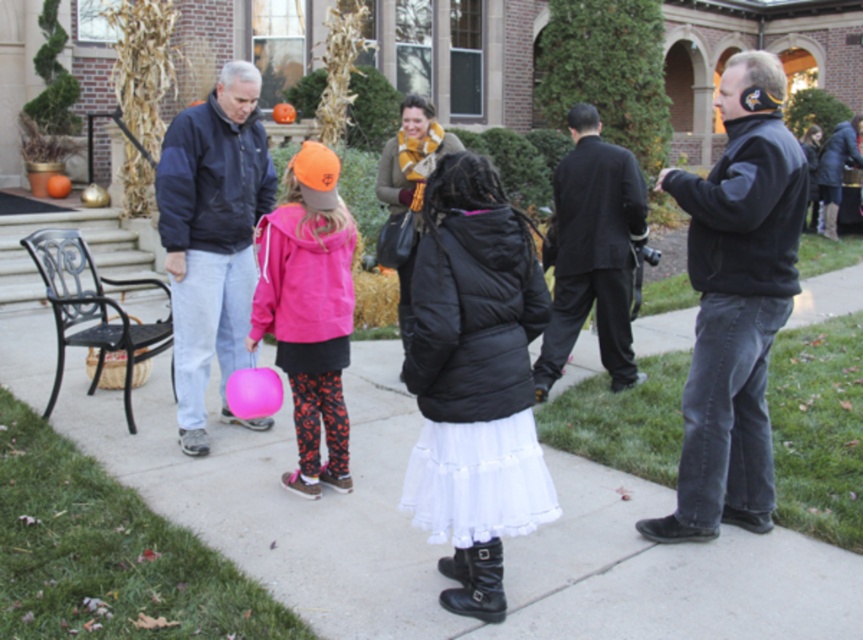
How far apart are white matte skirt at center and matte pink hoodie at center?

A distance of 1.17 meters exists between white matte skirt at center and matte pink hoodie at center.

Which is in front, point (470, 269) or point (322, 324)?

Positioned in front is point (470, 269).

Where is `white matte skirt at center`? white matte skirt at center is located at coordinates (476, 380).

Does white matte pavement at center appear on the left side of pink matte balloon at center?

No, white matte pavement at center is not to the left of pink matte balloon at center.

Who is more forward, (60,412) or (263,413)?

Point (263,413) is in front.

Locate an element on the screen. white matte pavement at center is located at coordinates (448, 545).

Image resolution: width=863 pixels, height=640 pixels. What are the coordinates of `white matte pavement at center` in the screenshot? It's located at [x=448, y=545].

Between point (468, 332) and point (741, 244), which one is positioned in front?

Point (468, 332) is in front.

In the scene shown: Can you confirm if white matte skirt at center is positioned below black fleece jacket at right?

Yes.

Measure the distance between white matte skirt at center and camera.

white matte skirt at center is 3.14 meters from camera.

The height and width of the screenshot is (640, 863). What are the coordinates of `white matte skirt at center` in the screenshot? It's located at (476, 380).